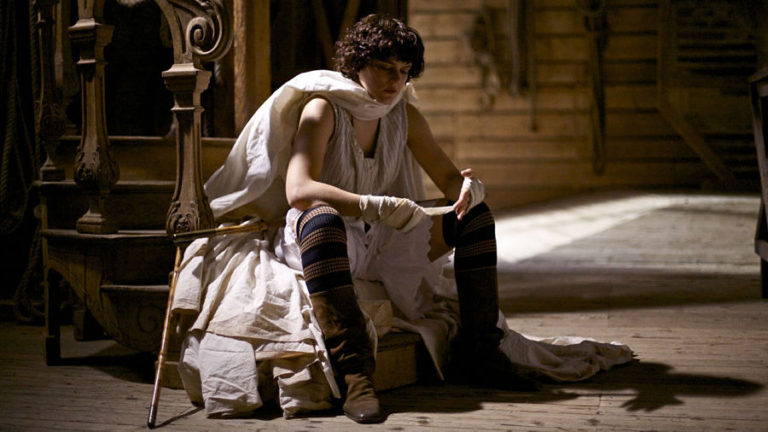
The image size is (768, 432). Find the location of `shadow of steps on floor`. shadow of steps on floor is located at coordinates (118, 372).